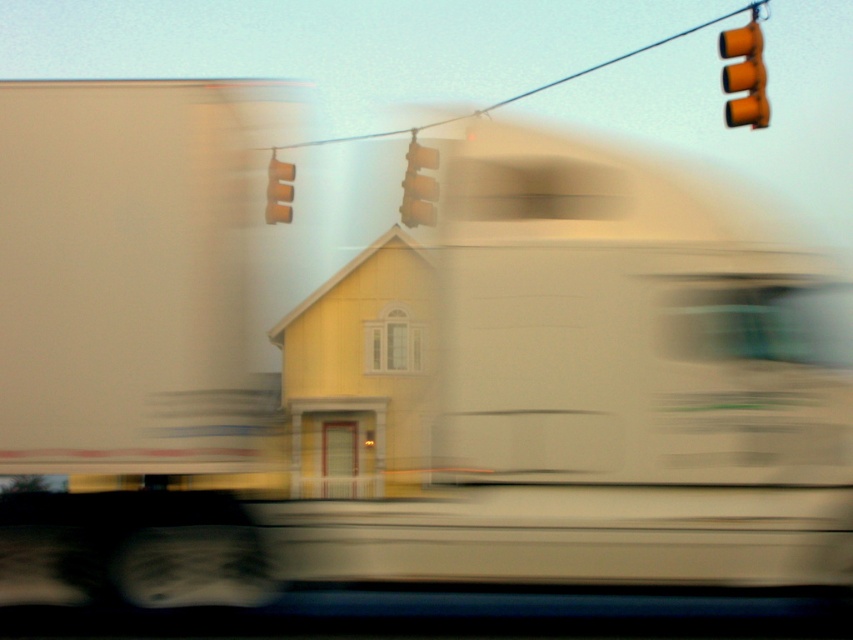
Is yellow matte traffic light at center wider than orange matte traffic light at upper center?

No, yellow matte traffic light at center is not wider than orange matte traffic light at upper center.

Is point (437, 161) positioned in front of point (268, 172)?

No.

Does point (410, 150) come behind point (273, 173)?

Yes, point (410, 150) is farther from viewer.

The image size is (853, 640). Identify the location of yellow matte traffic light at center. (418, 186).

Between yellow matte traffic light at upper right and orange matte traffic light at upper center, which one is positioned higher?

Positioned higher is yellow matte traffic light at upper right.

Which is behind, point (747, 54) or point (273, 182)?

The point (273, 182) is behind.

The image size is (853, 640). I want to click on yellow matte traffic light at upper right, so (x=744, y=74).

Which is more to the left, yellow matte traffic light at upper right or yellow matte traffic light at center?

yellow matte traffic light at center is more to the left.

Which is in front, point (764, 116) or point (428, 200)?

Positioned in front is point (764, 116).

Image resolution: width=853 pixels, height=640 pixels. Identify the location of yellow matte traffic light at upper right. (744, 74).